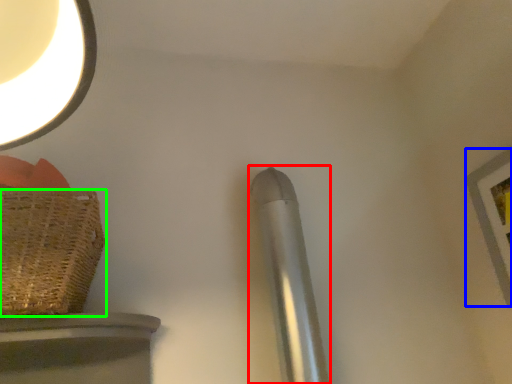
Question: Which object is positioned farthest from steel (highlighted by a red box)? Select from picture frame (highlighted by a blue box) and basket (highlighted by a green box).

Choices:
 (A) picture frame
 (B) basket

Answer: (A)